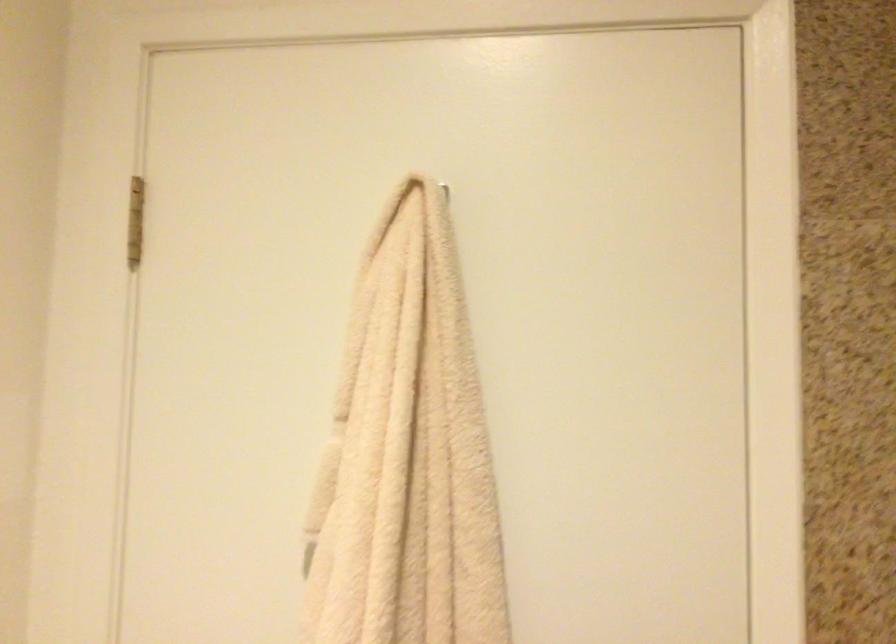
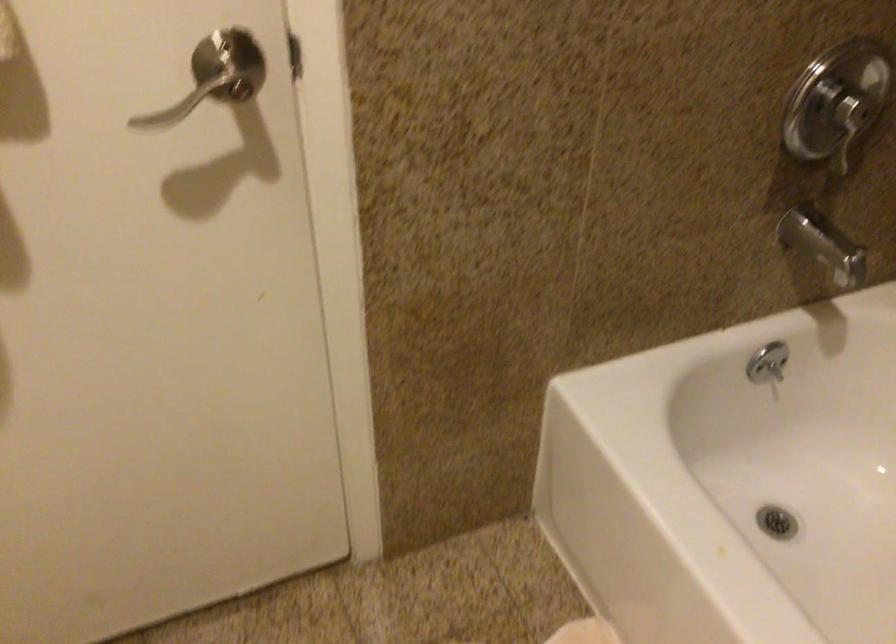
Based on the continuous images, in which direction is the camera rotating?

The rotation direction of the camera is right-down.